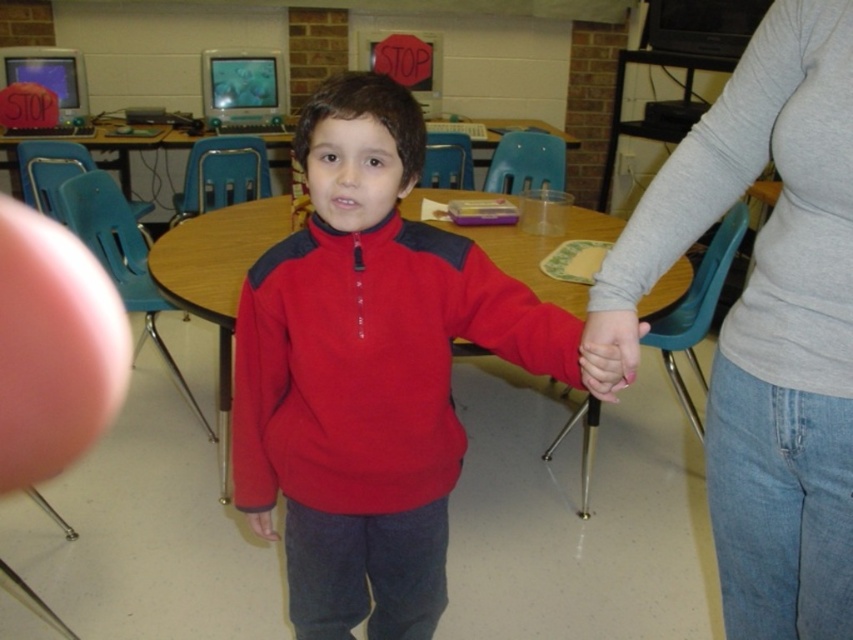
Please look at the image and identify the object located at the coordinates point (368, 371). What is it?

The object at point (368, 371) is the matte fleece sweater at center.